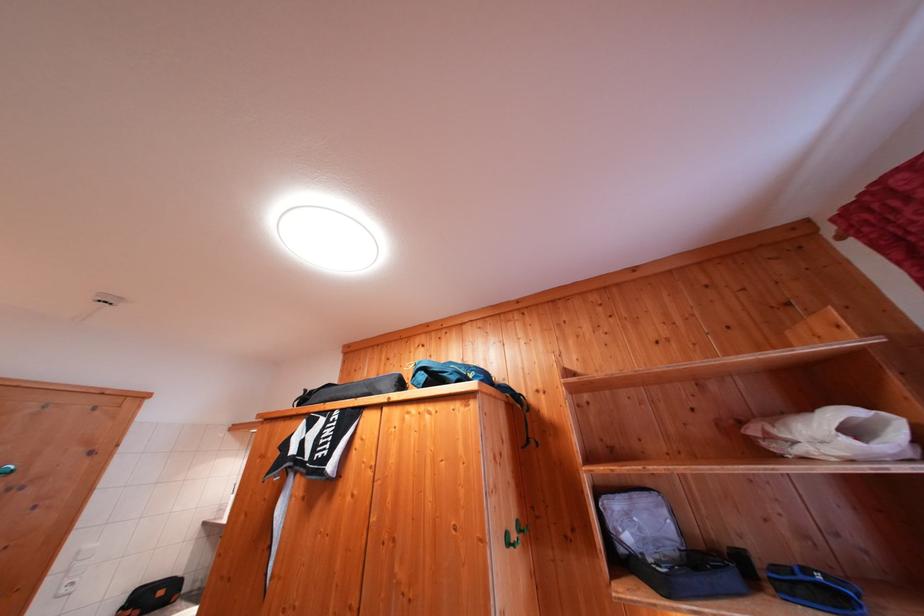
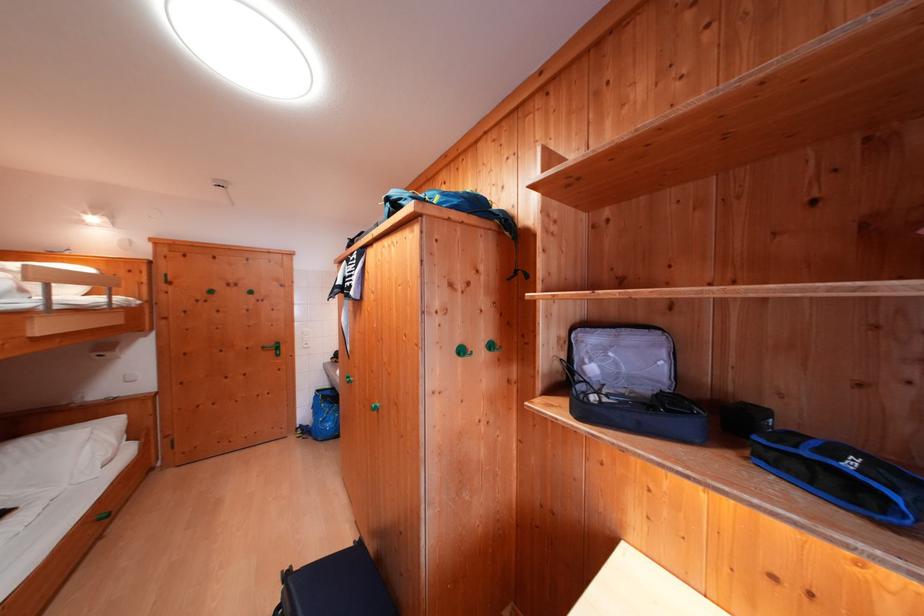
The point at (643, 523) is marked in the first image. Where is the corresponding point in the second image?

(619, 359)